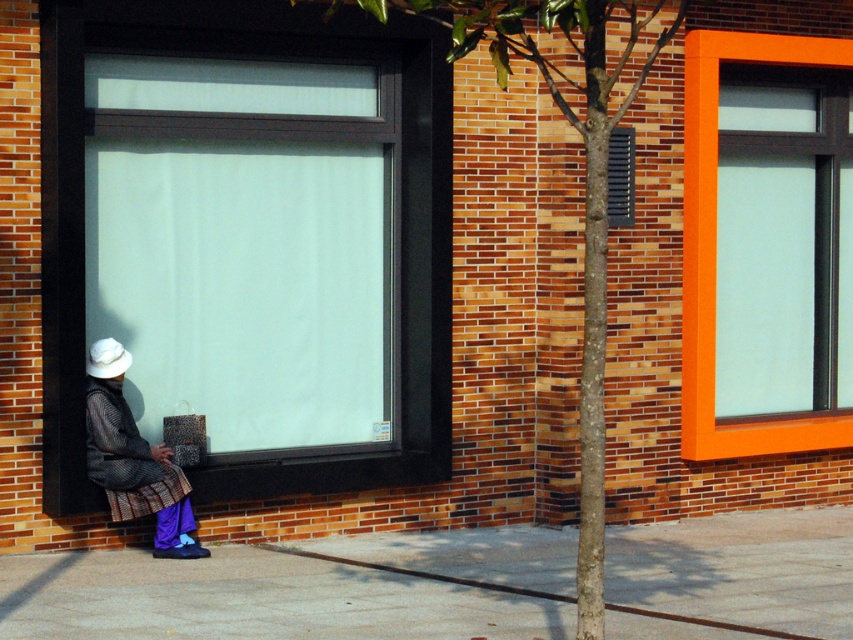
Question: Among these objects, which one is farthest from the camera?

Choices:
 (A) orange frame glass window at upper right
 (B) matte black coat at lower left
 (C) white felt hat at lower left
 (D) matte glass window at center

Answer: (A)

Question: Is orange frame glass window at upper right closer to the viewer compared to matte black coat at lower left?

Choices:
 (A) no
 (B) yes

Answer: (A)

Question: Which object is farther from the camera taking this photo?

Choices:
 (A) orange frame glass window at upper right
 (B) matte black coat at lower left

Answer: (A)

Question: Estimate the real-world distances between objects in this image. Which object is closer to the smooth bark tree at center?

Choices:
 (A) orange frame glass window at upper right
 (B) matte black coat at lower left
 (C) matte glass window at center
 (D) concrete pavement at lower center

Answer: (D)

Question: Can you confirm if matte black coat at lower left is bigger than white felt hat at lower left?

Choices:
 (A) no
 (B) yes

Answer: (B)

Question: Is smooth bark tree at center to the right of matte black coat at lower left from the viewer's perspective?

Choices:
 (A) yes
 (B) no

Answer: (A)